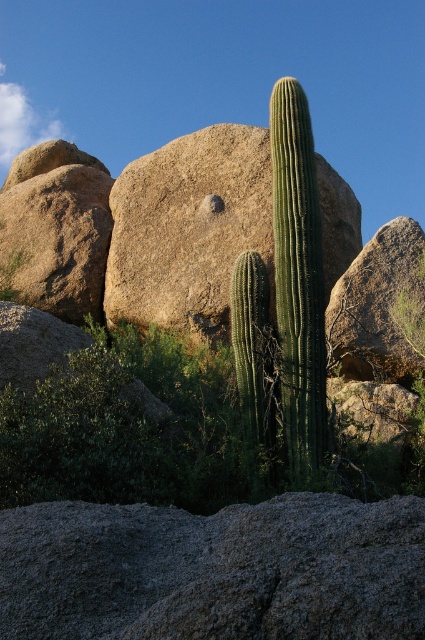
You are a geologist examining the desert scene. You notice the gray rough rock at lower center and the green spiny cactus at center. Which object is taller?

The green spiny cactus at center is taller than the gray rough rock at lower center.

You are a geologist examining the desert landscape. You notice the gray rough rock at lower center and the smooth beige rock at center. Which rock is closer to you based on their positions in the scene?

The gray rough rock at lower center is closer to you because it is positioned in front of the smooth beige rock at center.

You are a geologist examining the desert scene. You need to determine which object is bigger between the gray rough rock at lower center and the green spiny cactus at center. Based on the scene, which one is larger?

The gray rough rock at lower center is larger in size than the green spiny cactus at center according to the description.